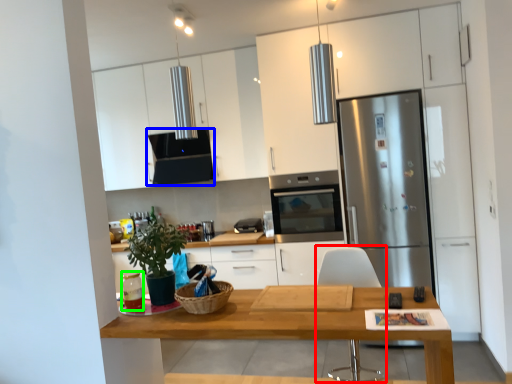
Question: Which is farther away from chair (highlighted by a red box)? exhaust hood (highlighted by a blue box) or appliance (highlighted by a green box)?

Choices:
 (A) exhaust hood
 (B) appliance

Answer: (A)